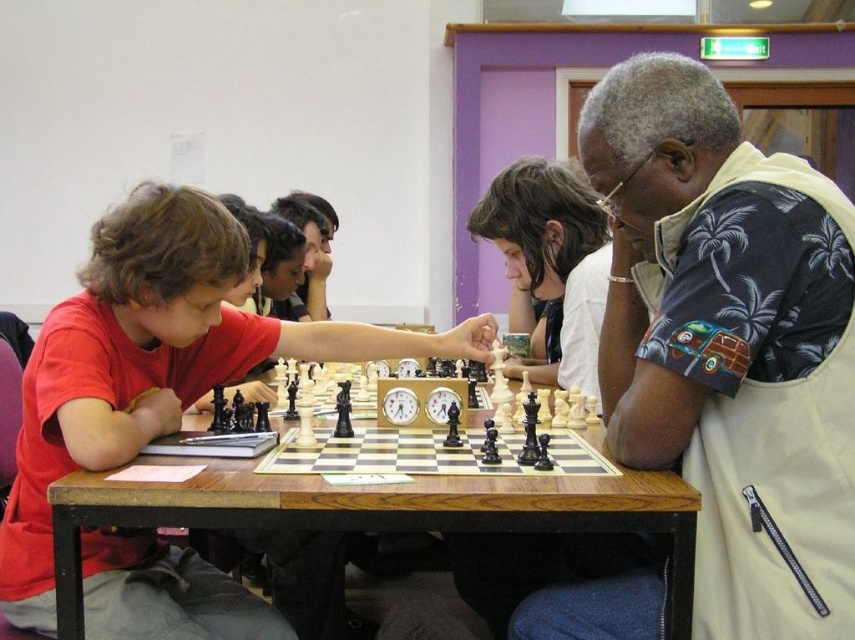
Question: Can you confirm if black floral shirt at right is smaller than matte black chess set at center?

Choices:
 (A) no
 (B) yes

Answer: (B)

Question: Which object is farther from the camera taking this photo?

Choices:
 (A) matte black chess set at center
 (B) black floral shirt at right

Answer: (A)

Question: Can you confirm if black floral shirt at right is positioned to the left of matte black chess set at center?

Choices:
 (A) no
 (B) yes

Answer: (A)

Question: Does black floral shirt at right appear over matte black chess set at center?

Choices:
 (A) no
 (B) yes

Answer: (B)

Question: Which object is farther from the camera taking this photo?

Choices:
 (A) black floral shirt at right
 (B) matte black chess set at center

Answer: (B)